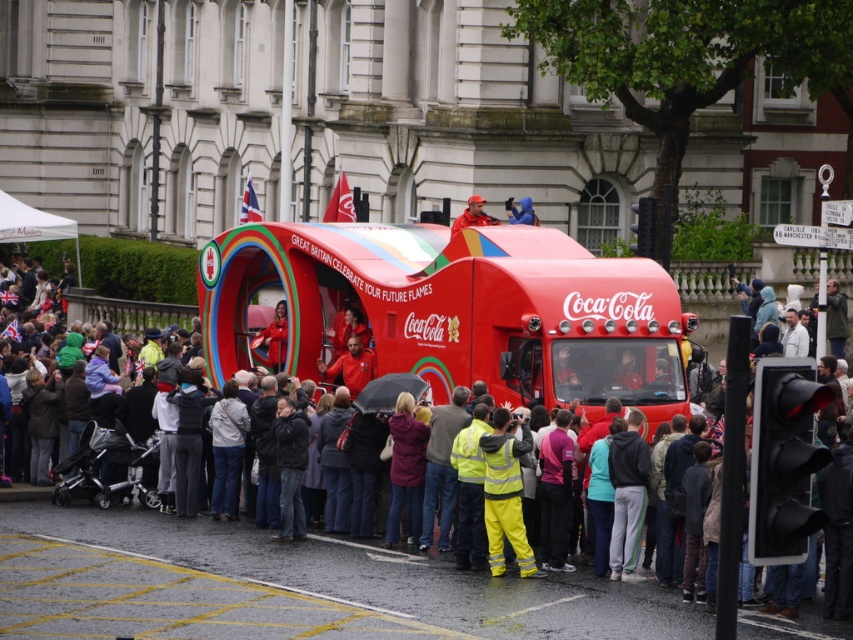
This screenshot has height=640, width=853. Describe the element at coordinates (473, 214) in the screenshot. I see `matte red cap at center` at that location.

Does matte red cap at center lie in front of blue fabric jacket at center?

Yes, matte red cap at center is closer to the viewer.

What do you see at coordinates (473, 214) in the screenshot?
I see `matte red cap at center` at bounding box center [473, 214].

Find the location of a particular element. The width and height of the screenshot is (853, 640). matte red cap at center is located at coordinates (473, 214).

Who is positioned more to the left, shiny red coca-cola truck at center or high visibility yellow jacket at center?

shiny red coca-cola truck at center

Is point (242, 337) closer to viewer compared to point (506, 506)?

No.

I want to click on shiny red coca-cola truck at center, so click(x=459, y=308).

Who is shorter, shiny red coca-cola truck at center or blue fabric jacket at center?

blue fabric jacket at center is shorter.

Can you confirm if shiny red coca-cola truck at center is positioned to the right of blue fabric jacket at center?

No, shiny red coca-cola truck at center is not to the right of blue fabric jacket at center.

Is point (445, 349) closer to camera compared to point (532, 214)?

That is True.

This screenshot has height=640, width=853. What are the coordinates of `shiny red coca-cola truck at center` in the screenshot? It's located at (459, 308).